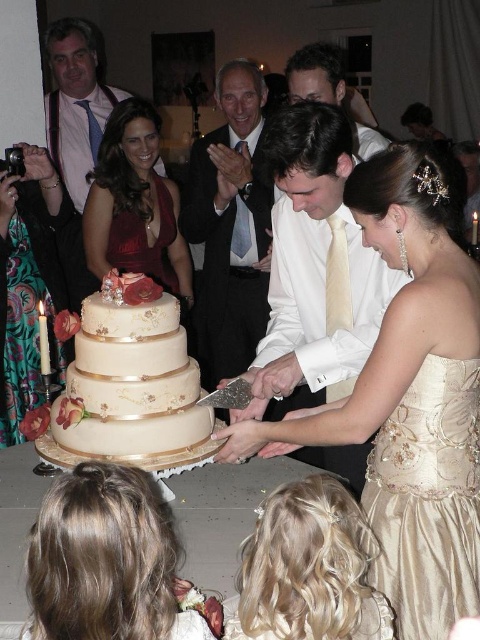
Does gold satin wedding dress at lower right have a larger size compared to matte cream cake at center?

No.

Who is more forward, [431,468] or [136,435]?

Point [431,468] is more forward.

Find the location of `gold satin wedding dress at lower right`. gold satin wedding dress at lower right is located at coordinates (428, 500).

Does white satin shirt at center have a lesser width compared to gold satin wedding dress at lower right?

In fact, white satin shirt at center might be wider than gold satin wedding dress at lower right.

Is white satin shirt at center below gold satin wedding dress at lower right?

No.

Which is behind, point (325, 140) or point (420, 627)?

Point (325, 140)

Locate an element on the screen. The width and height of the screenshot is (480, 640). white satin shirt at center is located at coordinates (314, 268).

Which is below, gold satin dress at center or velvet burgundy dress at center?

gold satin dress at center

Is point (442, 451) positioned in front of point (180, 292)?

Yes, it is in front of point (180, 292).

Is point (439, 630) more distant than point (179, 282)?

No, it is not.

I want to click on gold satin dress at center, so click(409, 394).